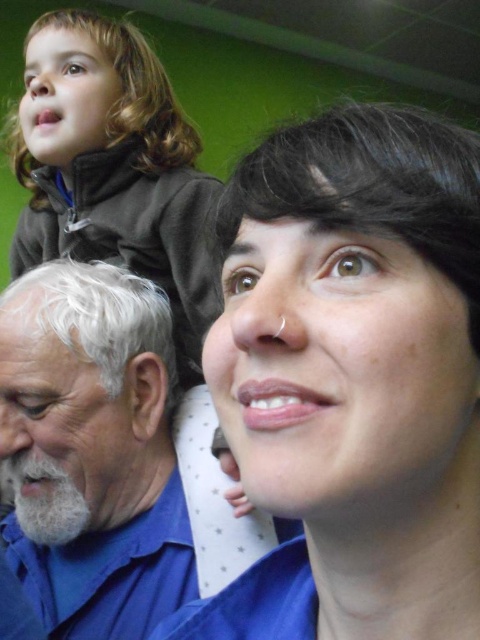
Question: Among these objects, which one is farthest from the camera?

Choices:
 (A) matte blue shirt at center
 (B) dark brown fleece at upper left

Answer: (B)

Question: Which point is closer to the camera?

Choices:
 (A) gray beard at left
 (B) dark brown fleece at upper left
 (C) matte blue shirt at center

Answer: (C)

Question: Can you confirm if matte blue shirt at center is positioned to the left of dark brown fleece at upper left?

Choices:
 (A) yes
 (B) no

Answer: (B)

Question: Does matte blue shirt at center have a smaller size compared to dark brown fleece at upper left?

Choices:
 (A) no
 (B) yes

Answer: (B)

Question: In this image, where is matte blue shirt at center located relative to dark brown fleece at upper left?

Choices:
 (A) right
 (B) left

Answer: (A)

Question: Considering the real-world distances, which object is closest to the gray beard at left?

Choices:
 (A) matte blue shirt at center
 (B) dark brown fleece at upper left

Answer: (B)